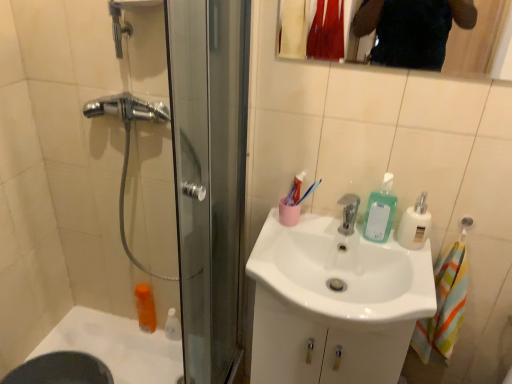
Question: Looking at their shapes, would you say orange plastic mouthwash at lower left is wider or thinner than white glossy bath at lower left?

Choices:
 (A) wide
 (B) thin

Answer: (B)

Question: In the image, is orange plastic mouthwash at lower left on the left side or the right side of white glossy bath at lower left?

Choices:
 (A) right
 (B) left

Answer: (A)

Question: Considering the real-world distances, which object is closest to the white glossy bottle at lower left?

Choices:
 (A) white glossy bath at lower left
 (B) translucent plastic soap dispenser at sink right, arranged as the 2th soap dispenser when viewed from the right
 (C) white glossy sink at center
 (D) white plastic soap dispenser at upper right, placed as the first soap dispenser when sorted from right to left
 (E) orange plastic mouthwash at lower left

Answer: (E)

Question: Which object is positioned farthest from the white glossy sink at center?

Choices:
 (A) white glossy bottle at lower left
 (B) clear glass mirror at upper center
 (C) translucent plastic soap dispenser at sink right, the 1th soap dispenser viewed from the left
 (D) white plastic soap dispenser at upper right, which ranks as the 2th soap dispenser in left-to-right order
 (E) white glossy bath at lower left

Answer: (B)